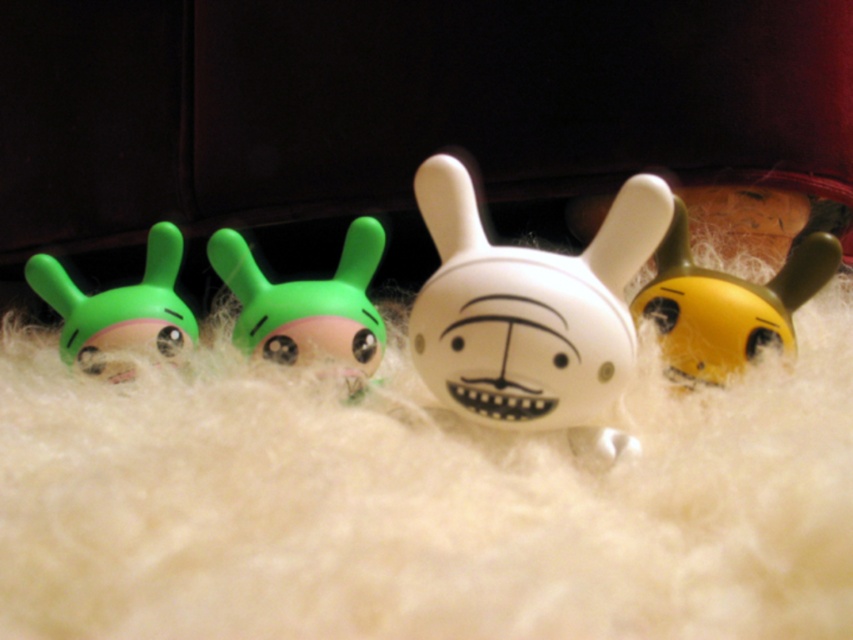
Question: Considering the real-world distances, which object is farthest from the matte green bunny at center?

Choices:
 (A) matte green bunny at left
 (B) white matte rabbit at center
 (C) white matte face at center

Answer: (C)

Question: Which of these objects is positioned closest to the yellow matte toy at right?

Choices:
 (A) white matte rabbit at center
 (B) matte green rabbit at center
 (C) white matte face at center
 (D) green matte toy at left

Answer: (A)

Question: Is green matte toy at left below matte green rabbit at center?

Choices:
 (A) yes
 (B) no

Answer: (B)

Question: Which of these objects is positioned farthest from the matte green rabbit at center?

Choices:
 (A) yellow matte toy at right
 (B) green matte toy at left

Answer: (A)

Question: Observing the image, what is the correct spatial positioning of yellow matte toy at right in reference to matte green rabbit at center?

Choices:
 (A) left
 (B) right

Answer: (B)

Question: Does white matte face at center have a larger size compared to matte green bunny at left?

Choices:
 (A) yes
 (B) no

Answer: (A)